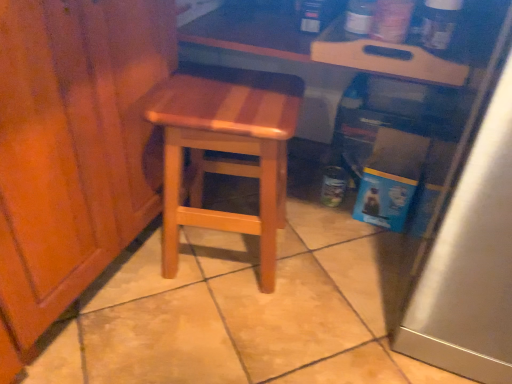
Question: Is the position of natural wood stool at center more distant than that of wooden tray at upper center?

Choices:
 (A) no
 (B) yes

Answer: (A)

Question: From the image's perspective, is natural wood stool at center under wooden tray at upper center?

Choices:
 (A) yes
 (B) no

Answer: (A)

Question: From a real-world perspective, is natural wood stool at center below wooden tray at upper center?

Choices:
 (A) no
 (B) yes

Answer: (B)

Question: Is natural wood stool at center to the left of wooden tray at upper center from the viewer's perspective?

Choices:
 (A) no
 (B) yes

Answer: (B)

Question: From a real-world perspective, is natural wood stool at center positioned over wooden tray at upper center based on gravity?

Choices:
 (A) yes
 (B) no

Answer: (B)

Question: Can you confirm if natural wood stool at center is taller than wooden tray at upper center?

Choices:
 (A) yes
 (B) no

Answer: (A)

Question: Does wooden tray at upper center have a lesser width compared to natural wood stool at center?

Choices:
 (A) no
 (B) yes

Answer: (A)

Question: Is wooden tray at upper center wider than natural wood stool at center?

Choices:
 (A) yes
 (B) no

Answer: (A)

Question: Is wooden tray at upper center placed right next to natural wood stool at center?

Choices:
 (A) no
 (B) yes

Answer: (A)

Question: Is wooden tray at upper center at the left side of natural wood stool at center?

Choices:
 (A) no
 (B) yes

Answer: (A)

Question: Is wooden tray at upper center outside natural wood stool at center?

Choices:
 (A) no
 (B) yes

Answer: (B)

Question: Considering the relative sizes of wooden tray at upper center and natural wood stool at center in the image provided, is wooden tray at upper center bigger than natural wood stool at center?

Choices:
 (A) no
 (B) yes

Answer: (A)

Question: Based on their positions, is natural wood stool at center located to the left or right of wooden tray at upper center?

Choices:
 (A) right
 (B) left

Answer: (B)